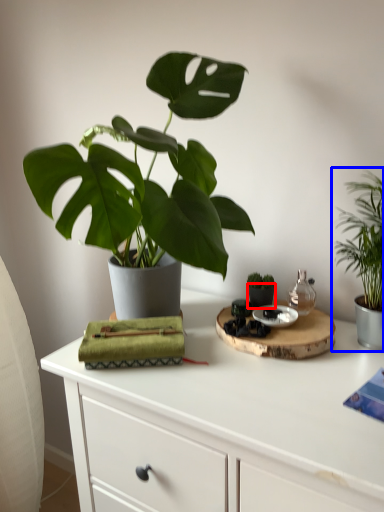
Question: Which of the following is the farthest to the observer, flowerpot (highlighted by a red box) or houseplant (highlighted by a blue box)?

Choices:
 (A) flowerpot
 (B) houseplant

Answer: (A)